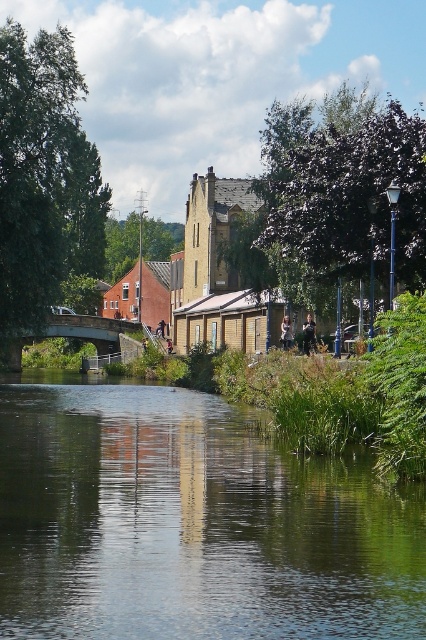
You are a photographer planning to take a wide shot of the riverside scene. You have a camera with a 30 cm wide lens. The green reflective water at center and the dark brown leather jacket at center are both in your frame. Can the lens capture both objects without cropping either of them?

The green reflective water at center is wider than the dark brown leather jacket at center. Since the lens is 30 cm wide, it can capture both objects as long as their combined width does not exceed 30 cm. However, the exact answer depends on their individual widths, which are not provided. Please provide more details for an accurate assessment.

You are a fashion designer observing two jackets in a riverside scene. You notice both the dark brown leather jacket at center and the light brown leather jacket at center. Which jacket has a more slender silhouette?

The dark brown leather jacket at center is thinner than the light brown leather jacket at center, so it has a more slender silhouette.

You are a photographer standing at the riverside and want to capture both the green reflective water at center and the light brown leather jacket at center in your shot. Which object will appear taller in the photograph?

The light brown leather jacket at center will appear taller in the photograph since it has a greater height than the green reflective water at center according to the description.